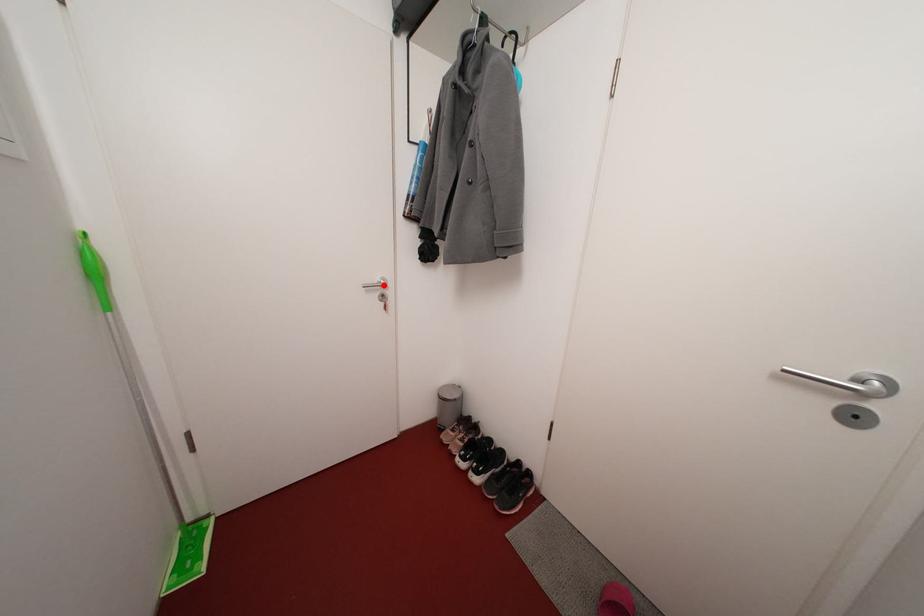
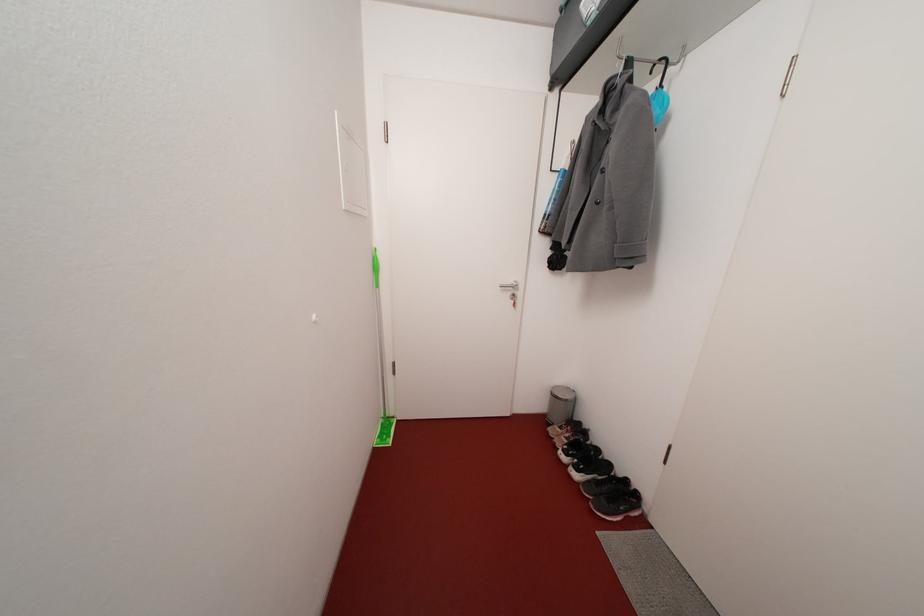
Question: I am providing you with two images of the same scene from different viewpoints. A red point is marked on the first image. At the location where the point appears in image 1, is it still visible in image 2?

Choices:
 (A) Yes
 (B) No

Answer: (A)